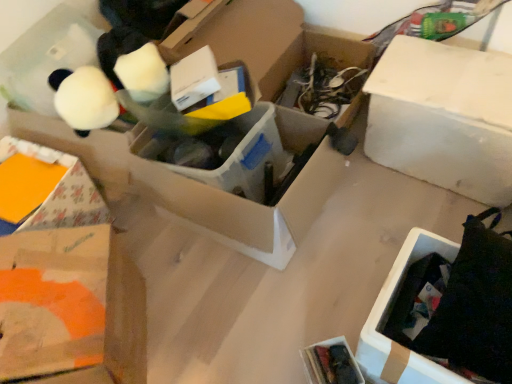
You are a GUI agent. You are given a task and a screenshot of the screen. Output one action in this format:
    pyautogui.click(x=<x>, y=<y>)
    Task: Click on the blank space to the left of black cardboard box at lower right
    The height and width of the screenshot is (384, 512).
    Given the screenshot: What is the action you would take?
    pyautogui.click(x=308, y=323)